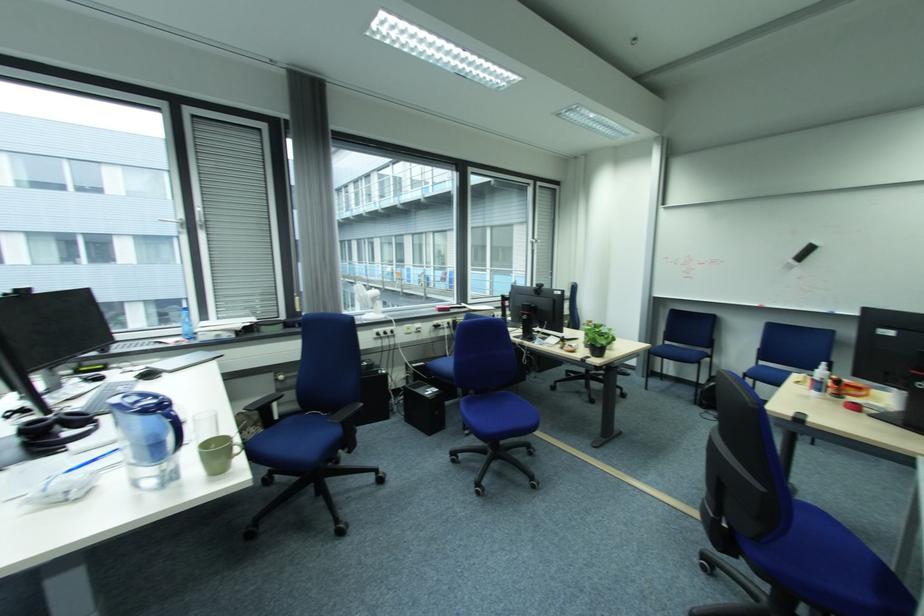
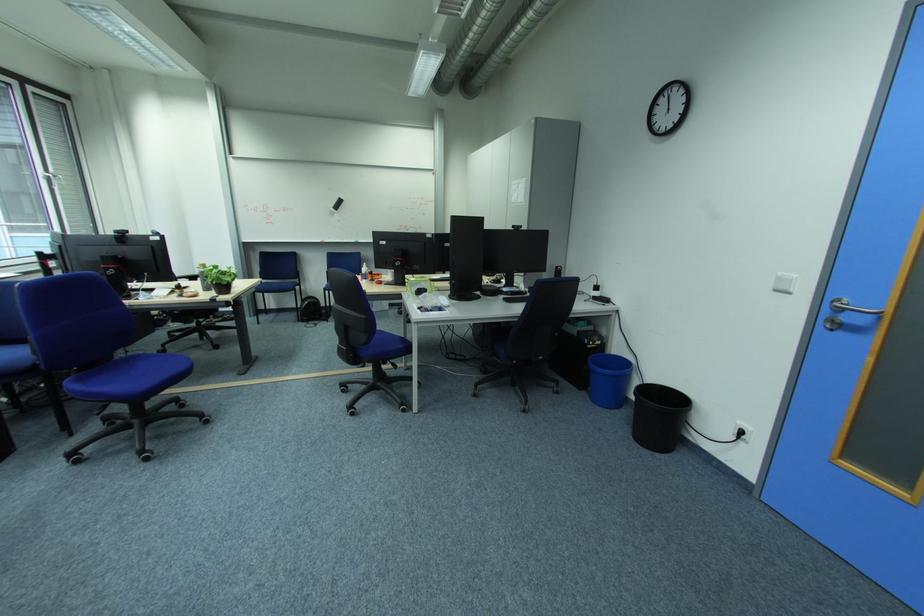
Question: The camera is either moving clockwise (left) or counter-clockwise (right) around the object. The first image is from the beginning of the video and the second image is from the end. Is the camera moving left or right when shooting the video?

Choices:
 (A) Left
 (B) Right

Answer: (A)